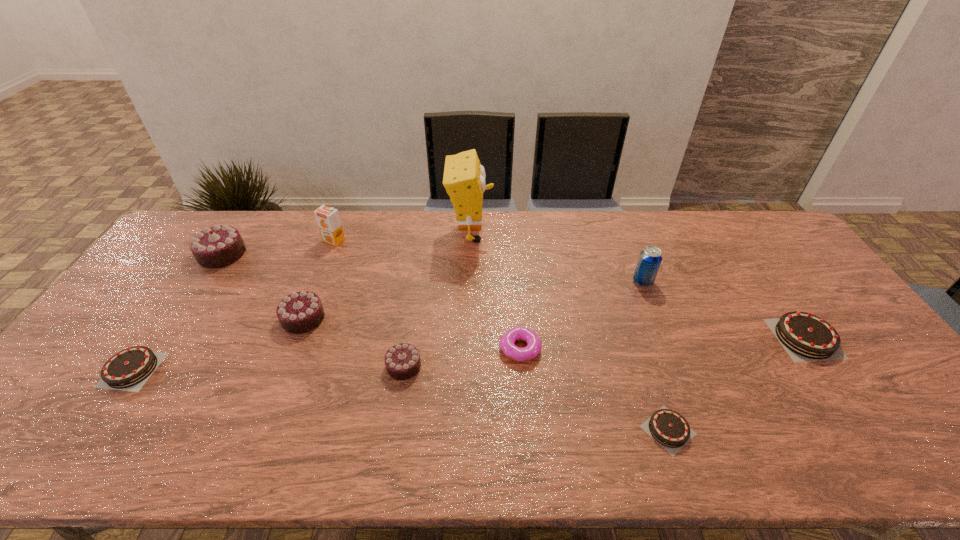
You are a GUI agent. You are given a task and a screenshot of the screen. Output one action in this format:
    pyautogui.click(x=<x>, y=<y>)
    Task: Click on the sixth object from left to right
    The image size is (960, 540).
    Given the screenshot: What is the action you would take?
    pyautogui.click(x=464, y=179)

The width and height of the screenshot is (960, 540). Find the location of `yellow sponge`. yellow sponge is located at coordinates (464, 179).

Locate an element on the screen. The height and width of the screenshot is (540, 960). orange juice is located at coordinates (328, 220).

Locate an element on the screen. This screenshot has width=960, height=540. the seventh nearest object is located at coordinates (650, 258).

This screenshot has height=540, width=960. I want to click on blue beer can, so click(650, 258).

Where is `the biggest chocolate chocolate cake`? Image resolution: width=960 pixels, height=540 pixels. the biggest chocolate chocolate cake is located at coordinates (218, 246).

The height and width of the screenshot is (540, 960). Identify the location of the farthest chocolate chocolate cake. (218, 246).

Identify the location of the third chocolate cake from left to right. (300, 312).

I want to click on the second tallest chocolate cake, so click(x=300, y=312).

You are a GUI agent. You are given a task and a screenshot of the screen. Output one action in this format:
    pyautogui.click(x=<x>, y=<y>)
    Task: Click on the nearest chocolate chocolate cake
    The width and height of the screenshot is (960, 540).
    Given the screenshot: What is the action you would take?
    pyautogui.click(x=402, y=361)